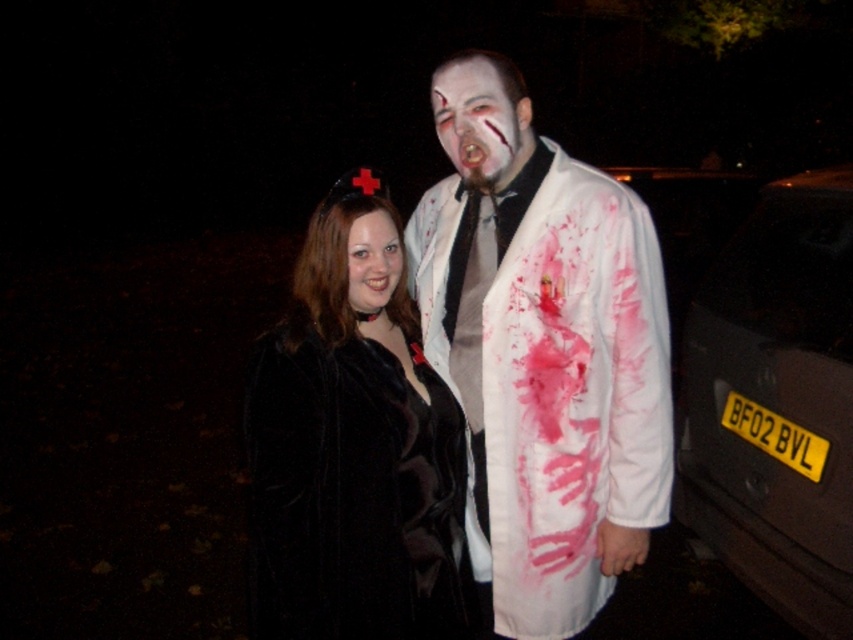
Question: Based on their relative distances, which object is nearer to the white matte lab coat at center?

Choices:
 (A) black fur coat at center
 (B) white matte face at center

Answer: (A)

Question: In this image, where is white matte lab coat at center located relative to white matte face at center?

Choices:
 (A) left
 (B) right

Answer: (B)

Question: Is white matte face at center behind smooth black hair at center?

Choices:
 (A) no
 (B) yes

Answer: (B)

Question: Can you confirm if white matte lab coat at center is positioned to the left of black plastic car at right?

Choices:
 (A) no
 (B) yes

Answer: (B)

Question: Which of the following is the closest to the observer?

Choices:
 (A) (490, 76)
 (B) (433, 516)
 (C) (541, 573)

Answer: (B)

Question: Which of these objects is positioned closest to the black plastic car at right?

Choices:
 (A) white matte face at center
 (B) white matte lab coat at center
 (C) black fur coat at center
 (D) smooth black hair at center

Answer: (B)